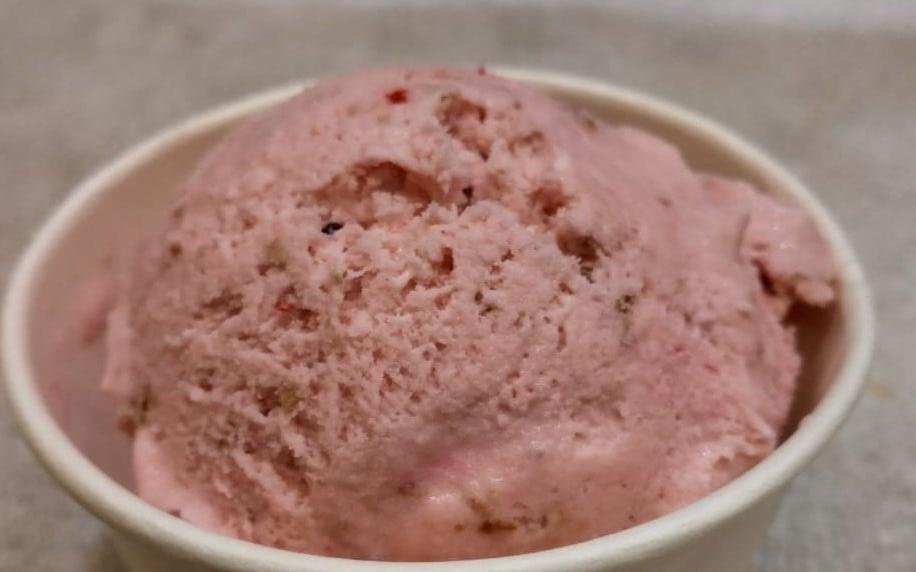
Locate an element on the screen. This screenshot has width=916, height=572. inner left side of bowl is located at coordinates (82, 405).